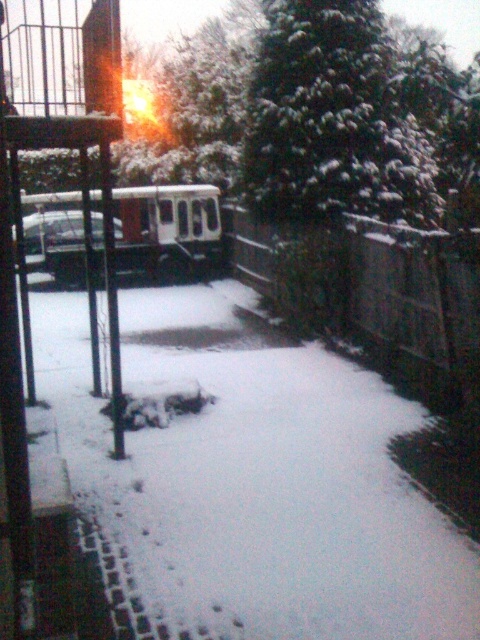
Can you confirm if white matte train at center is shorter than metallic silver car at left?

Indeed, white matte train at center has a lesser height compared to metallic silver car at left.

The height and width of the screenshot is (640, 480). Describe the element at coordinates (167, 228) in the screenshot. I see `white matte train at center` at that location.

Is point (206, 186) more distant than point (70, 243)?

Yes, point (206, 186) is farther from viewer.

The width and height of the screenshot is (480, 640). Find the location of `white matte train at center`. white matte train at center is located at coordinates (167, 228).

Which of these two, snow-covered evergreen at upper center or white matte train at center, stands taller?

snow-covered evergreen at upper center

Between point (285, 129) and point (75, 257), which one is positioned behind?

Positioned behind is point (75, 257).

Is point (348, 131) positioned behind point (80, 241)?

No.

This screenshot has width=480, height=640. I want to click on snow-covered evergreen at upper center, so click(333, 120).

Does snow-covered evergreen at upper center have a greater width compared to metallic silver car at left?

In fact, snow-covered evergreen at upper center might be narrower than metallic silver car at left.

Which of these two, snow-covered evergreen at upper center or metallic silver car at left, stands shorter?

metallic silver car at left

Is point (338, 204) in front of point (76, 228)?

Yes, point (338, 204) is closer to viewer.

Find the location of a particular element. snow-covered evergreen at upper center is located at coordinates (333, 120).